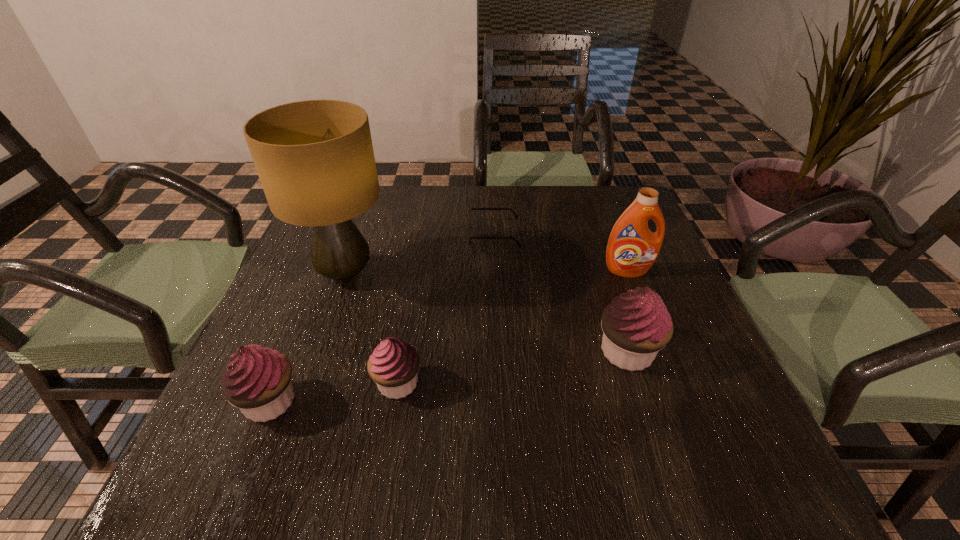
At what (x,y) coordinates should I click in order to perform the action: click on cupcake at the right edge. Please return your answer as a coordinate pair (x, y). The width and height of the screenshot is (960, 540). Looking at the image, I should click on (636, 325).

The image size is (960, 540). I want to click on detergent at the right edge, so click(x=632, y=249).

This screenshot has width=960, height=540. I want to click on object present at the near left corner, so pyautogui.click(x=257, y=380).

You are a GUI agent. You are given a task and a screenshot of the screen. Output one action in this format:
    pyautogui.click(x=<x>, y=<y>)
    Task: Click on the vacant space at the far edge of the desktop
    The width and height of the screenshot is (960, 540).
    Given the screenshot: What is the action you would take?
    pyautogui.click(x=488, y=207)

I want to click on free region at the near edge of the desktop, so click(579, 396).

The width and height of the screenshot is (960, 540). In the image, there is a desktop. In order to click on vacant space at the left edge in this screenshot , I will do `click(309, 339)`.

In the image, there is a desktop. Identify the location of vacant space at the right edge. [667, 267].

In order to click on vacant space at the near right corner of the desktop in this screenshot , I will do `click(663, 426)`.

Image resolution: width=960 pixels, height=540 pixels. Find the location of `blank region between the fifth shortest object and the third object from right to left`. blank region between the fifth shortest object and the third object from right to left is located at coordinates (561, 253).

I want to click on free space between the spectacles and the rightmost cupcake, so click(x=561, y=293).